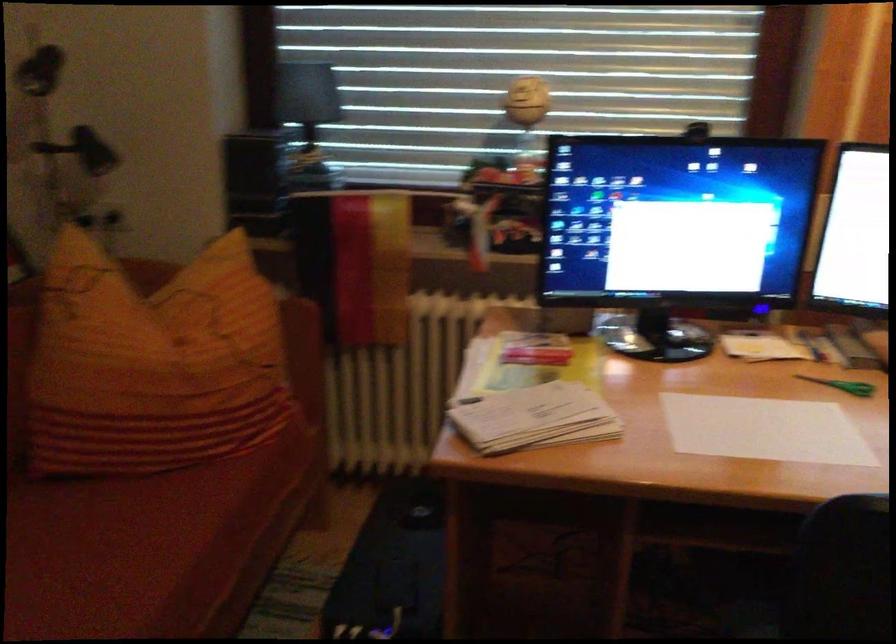
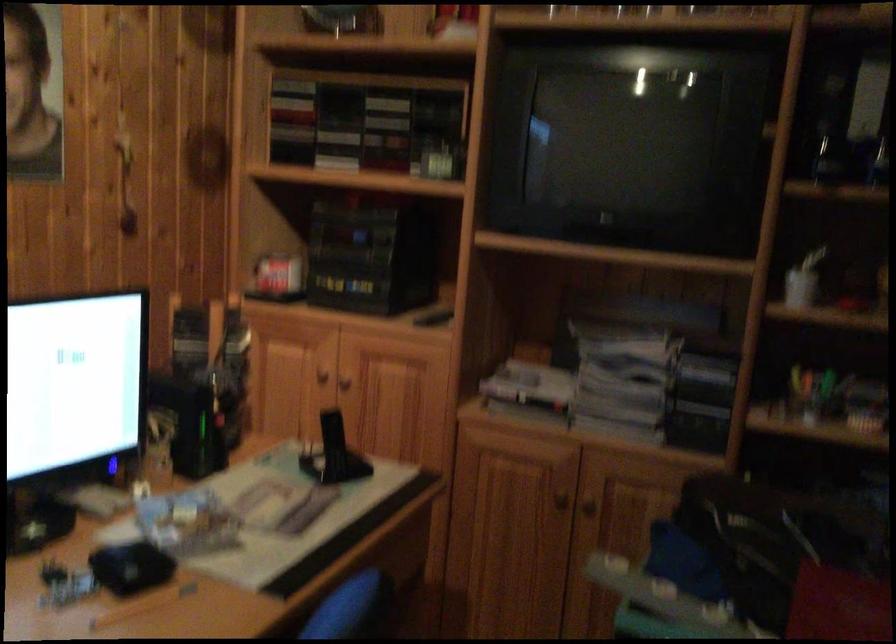
Question: The images are taken continuously from a first-person perspective. In which direction is your viewpoint rotating?

Choices:
 (A) Left
 (B) Right
 (C) Up
 (D) Down

Answer: (B)